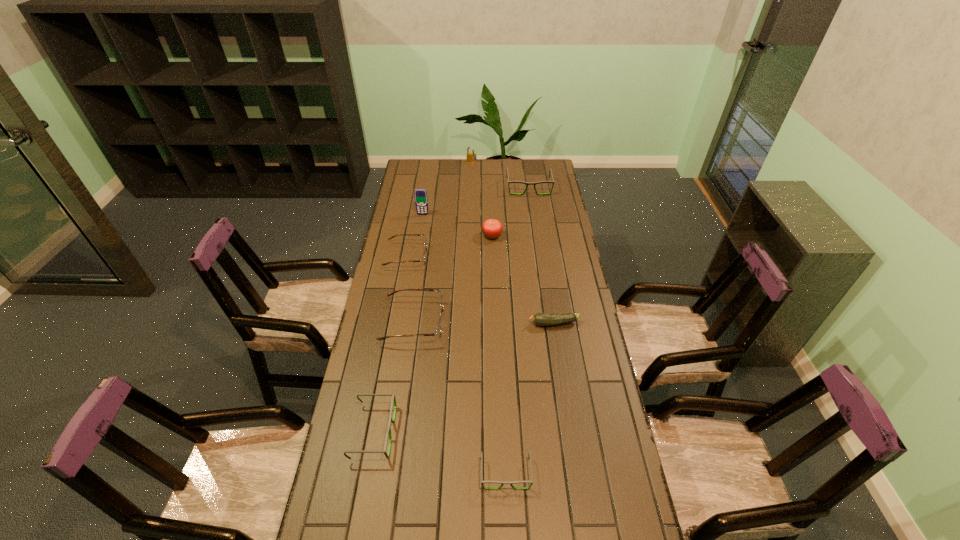
Find the location of a particular element. The height and width of the screenshot is (540, 960). free space located 0.230m on the lens of the second biggest black spectacles is located at coordinates (470, 431).

You are a GUI agent. You are given a task and a screenshot of the screen. Output one action in this format:
    pyautogui.click(x=<x>, y=<y>)
    Task: Click on the vacant space located on the front-facing side of the smaller brown spectacles
    
    Given the screenshot: What is the action you would take?
    pyautogui.click(x=498, y=256)

What are the coordinates of `free space located 0.230m at the blossom end of the green zucchini` in the screenshot? It's located at (466, 323).

Identify the location of blank area located at the blossom end of the green zucchini. (501, 323).

Where is `vacant space located at the blossom end of the green zucchini`? vacant space located at the blossom end of the green zucchini is located at coordinates (495, 323).

Locate an element on the screen. free space located 0.060m on the lens of the smallest black spectacles is located at coordinates (508, 514).

Where is `padlock situated at the far edge`? padlock situated at the far edge is located at coordinates (471, 157).

Identify the location of spectacles that is at the far edge. (527, 183).

You are a GUI agent. You are given a task and a screenshot of the screen. Output one action in this format:
    pyautogui.click(x=<x>, y=<y>)
    Task: Click on the cellular telephone that is at the left edge
    
    Given the screenshot: What is the action you would take?
    pyautogui.click(x=421, y=199)

Image resolution: width=960 pixels, height=540 pixels. What are the coordinates of `spectacles that is at the right edge` in the screenshot? It's located at coord(527,183).